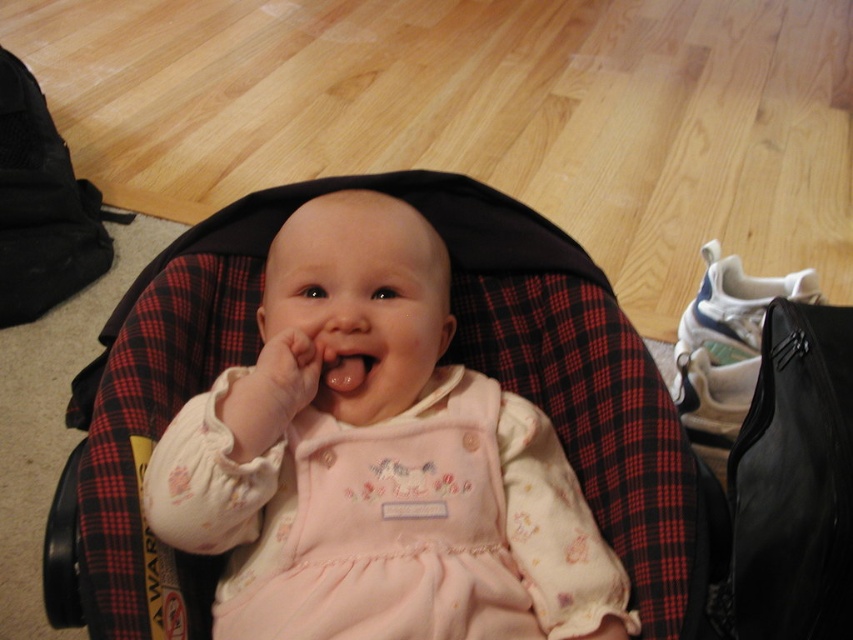
Measure the distance between pink fabric baby at center and camera.

29.81 inches

Is pink fabric baby at center above pink matte/satin mouth at center?

Actually, pink fabric baby at center is below pink matte/satin mouth at center.

The height and width of the screenshot is (640, 853). Identify the location of pink fabric baby at center. (376, 464).

You are a GUI agent. You are given a task and a screenshot of the screen. Output one action in this format:
    pyautogui.click(x=<x>, y=<y>)
    Task: Click on the pink fabric baby at center
    This screenshot has width=853, height=640.
    Given the screenshot: What is the action you would take?
    pyautogui.click(x=376, y=464)